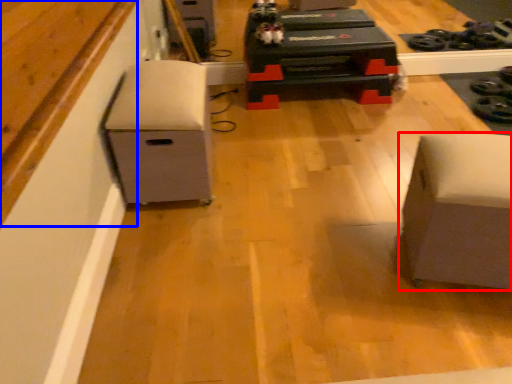
Question: Which point is further to the camera, furniture (highlighted by a red box) or wood (highlighted by a blue box)?

Choices:
 (A) furniture
 (B) wood

Answer: (A)